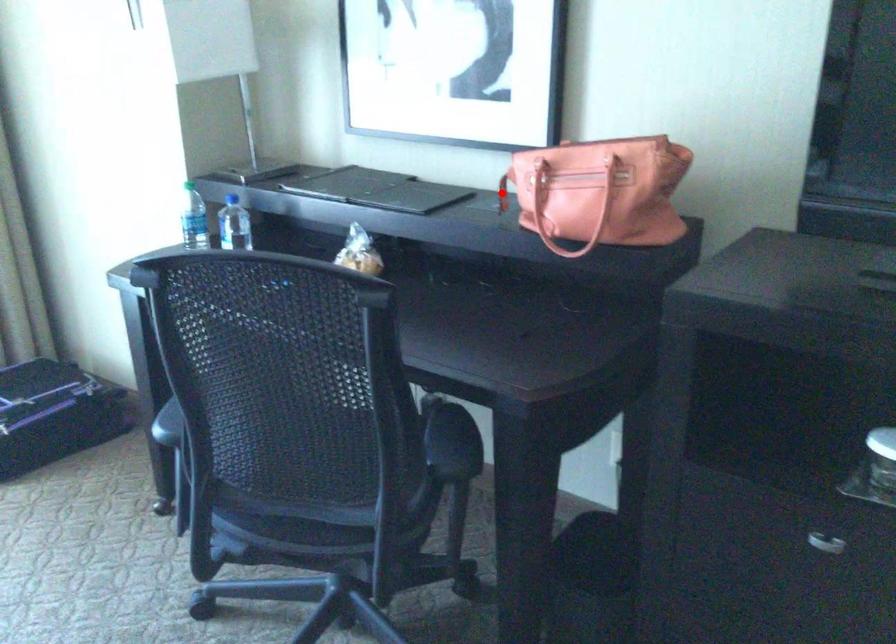
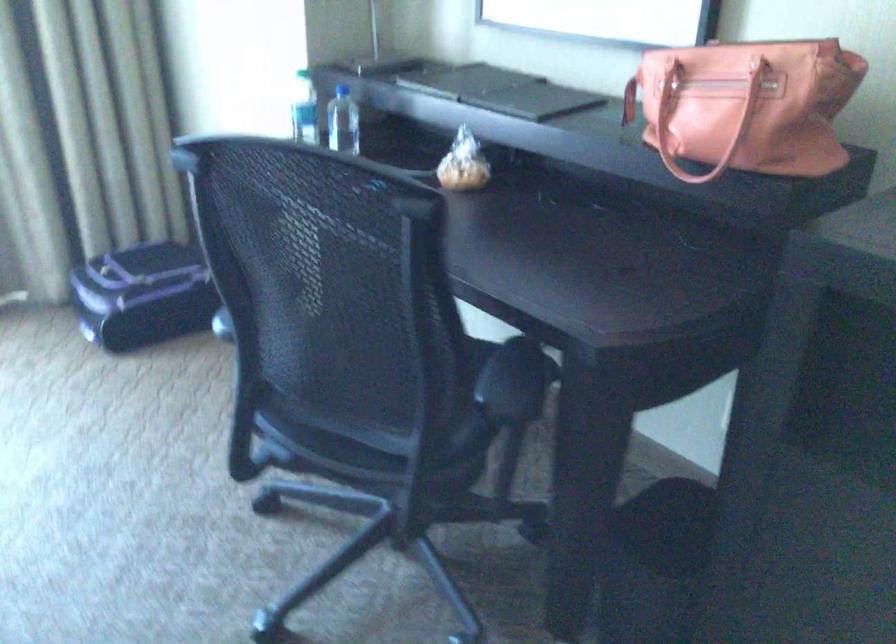
Where in the second image is the point corresponding to the highlighted location from the first image?

(629, 100)